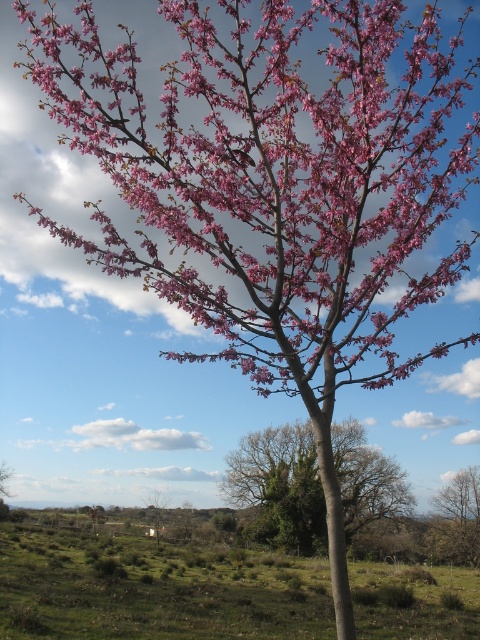
Question: Which point is farther to the camera?

Choices:
 (A) (253, 208)
 (B) (6, 506)

Answer: (B)

Question: Which of the following is the farthest from the observer?

Choices:
 (A) green rough bark tree at center
 (B) bare branches at lower right

Answer: (B)

Question: Among these points, which one is nearest to the camera?

Choices:
 (A) (428, 611)
 (B) (272, 134)

Answer: (B)

Question: Does pink matte flowers at upper center lie in front of green matte house at center?

Choices:
 (A) no
 (B) yes

Answer: (B)

Question: Can you confirm if green grassy field at lower left is positioned to the right of pink matte tree at center?

Choices:
 (A) no
 (B) yes

Answer: (B)

Question: Is pink matte flowers at upper center behind green matte house at center?

Choices:
 (A) yes
 (B) no

Answer: (B)